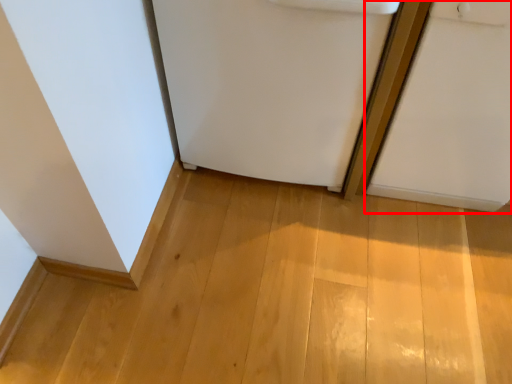
Question: From the image's perspective, considering the relative positions of door (annotated by the red box) and refrigerator in the image provided, where is door (annotated by the red box) located with respect to the staircase?

Choices:
 (A) below
 (B) above

Answer: (A)